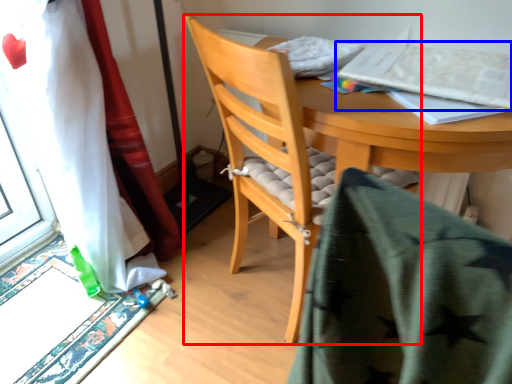
Question: Which object appears closest to the camera in this image, chair (highlighted by a red box) or paperback book (highlighted by a blue box)?

Choices:
 (A) chair
 (B) paperback book

Answer: (A)